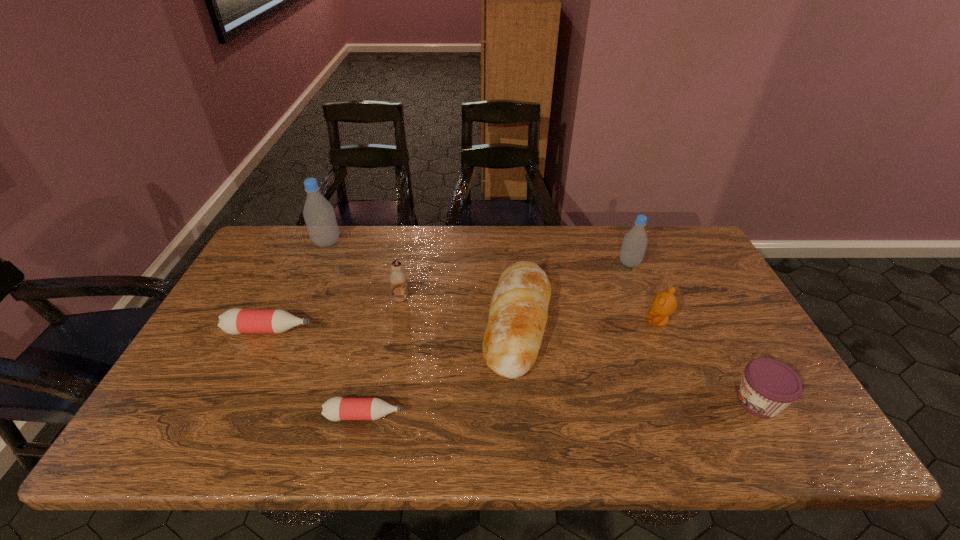
Locate an element on the screen. object located at the near right corner is located at coordinates (768, 386).

The height and width of the screenshot is (540, 960). In order to click on free space at the far edge of the desktop in this screenshot , I will do `click(588, 245)`.

Image resolution: width=960 pixels, height=540 pixels. In order to click on vacant area at the near edge in this screenshot , I will do `click(252, 451)`.

Identify the location of free space at the left edge of the desktop. The width and height of the screenshot is (960, 540). (248, 342).

Locate an element on the screen. This screenshot has width=960, height=540. vacant space at the right edge of the desktop is located at coordinates (737, 318).

In the image, there is a desktop. At what (x,y) coordinates should I click in order to perform the action: click on vacant space at the far right corner. Please return your answer as a coordinate pair (x, y). This screenshot has width=960, height=540. Looking at the image, I should click on (690, 269).

Where is `vacant region at the near right corner of the desktop`? Image resolution: width=960 pixels, height=540 pixels. vacant region at the near right corner of the desktop is located at coordinates (765, 418).

Locate an element on the screen. This screenshot has width=960, height=540. free point between the chocolate milk and the farthest object is located at coordinates (364, 271).

This screenshot has height=540, width=960. I want to click on free point between the left pink bottle and the farther gray bottle, so click(299, 286).

The image size is (960, 540). In order to click on unoccupied position between the right gray bottle and the teddy bear in this screenshot , I will do `click(644, 292)`.